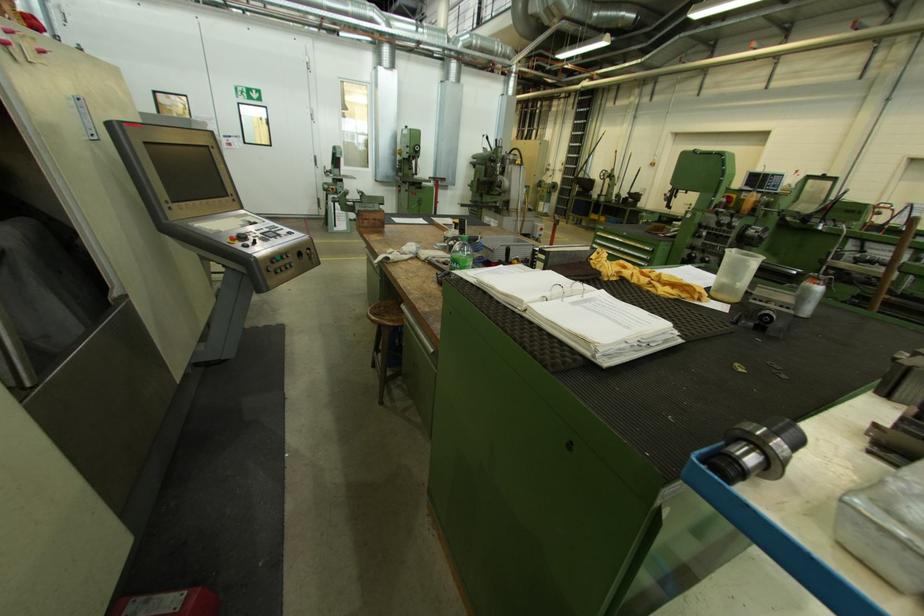
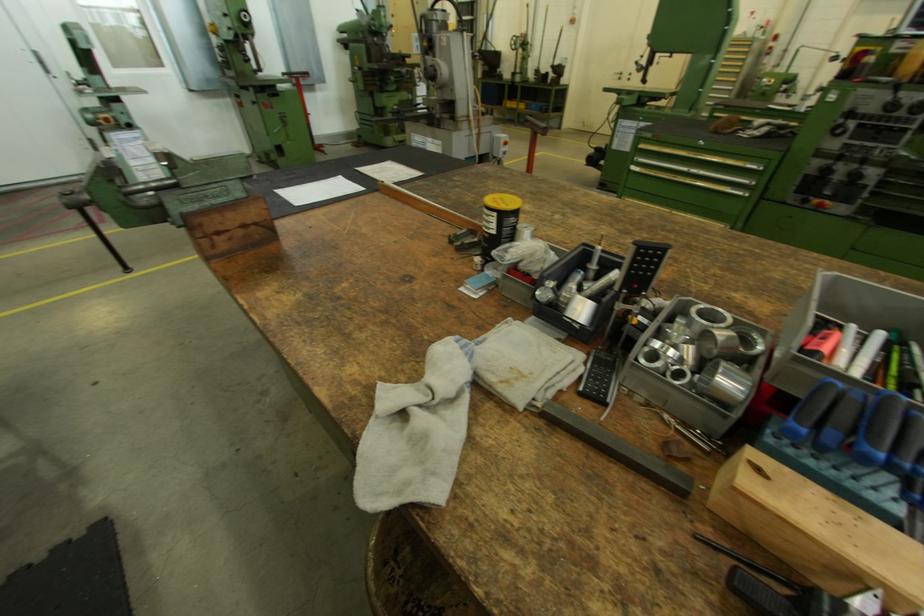
Where in the second image is the point corresponding to the point at 444,177 from the first image?

(299, 71)